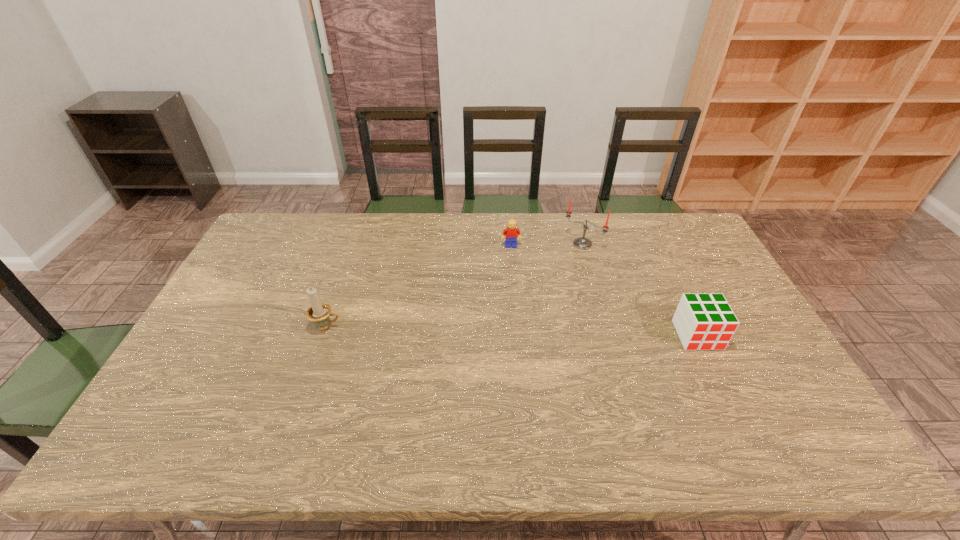
Where is `the leftmost object`? The image size is (960, 540). the leftmost object is located at coordinates (319, 313).

The height and width of the screenshot is (540, 960). In order to click on cube in this screenshot , I will do `click(703, 321)`.

Where is `Lego`? Lego is located at coordinates (510, 232).

This screenshot has width=960, height=540. Identify the location of the second object from right to left. (581, 242).

Identify the location of blank space located on the handle side of the leftmost object. (470, 327).

The image size is (960, 540). In order to click on vacant space situated on the red face of the rightmost object in this screenshot , I will do `click(734, 413)`.

Locate an element on the screen. free space located on the face of the third object from right to left is located at coordinates (523, 326).

This screenshot has height=540, width=960. I want to click on vacant region located 0.300m on the face of the third object from right to left, so click(x=520, y=310).

Locate an element on the screen. Image resolution: width=960 pixels, height=540 pixels. vacant space located on the face of the third object from right to left is located at coordinates (516, 275).

This screenshot has width=960, height=540. I want to click on free space located 0.160m on the front-facing side of the candle, so click(549, 275).